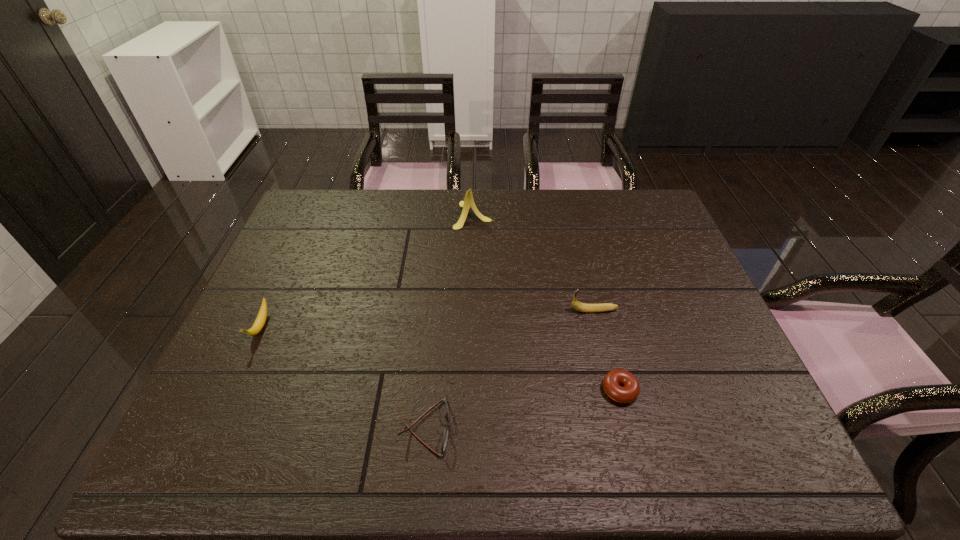
This screenshot has height=540, width=960. Find the location of `the tallest banana`. the tallest banana is located at coordinates (468, 202).

Find the location of a particular element. The height and width of the screenshot is (540, 960). the second banana from left to right is located at coordinates (468, 202).

This screenshot has width=960, height=540. I want to click on the second tallest object, so click(582, 307).

The image size is (960, 540). I want to click on the rightmost banana, so click(582, 307).

The image size is (960, 540). Identify the location of the third shortest object. (262, 315).

You are a GUI agent. You are given a task and a screenshot of the screen. Output one action in this format:
    pyautogui.click(x=<x>, y=<y>)
    Task: Click on the leftmost object
    The height and width of the screenshot is (540, 960).
    Given the screenshot: What is the action you would take?
    pyautogui.click(x=262, y=315)

The width and height of the screenshot is (960, 540). Identify the location of spectacles. (446, 431).

The image size is (960, 540). Find the location of `doughnut`. doughnut is located at coordinates (613, 379).

I want to click on free location located 0.060m on the left of the tallest object, so click(436, 215).

The width and height of the screenshot is (960, 540). What are the coordinates of `free region located 0.330m at the stem of the second tallest object` in the screenshot? It's located at (445, 310).